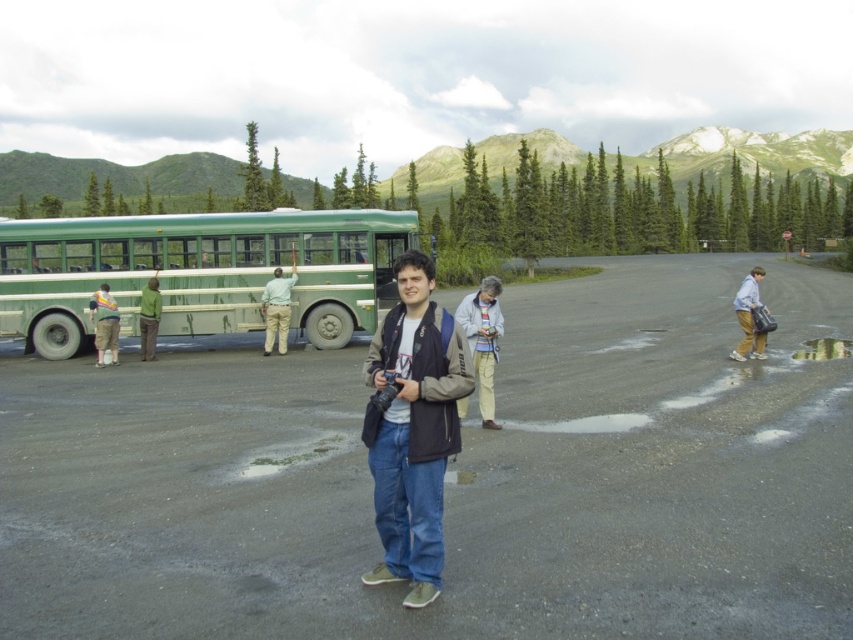
You are a photographer trying to capture a clear shot of the khaki pants at left and the green fabric pants at left in the scene. Since you want both subjects to be in focus, which one should you focus on first to ensure the other is also sharp?

You should focus on the khaki pants at left first because it is in front of the green fabric pants at left, so if you focus on the closer subject, the depth of field may include the background subject as well.

You are a delivery driver who needs to park your vehicle on the dark asphalt parking lot at center. However, you notice the transparent wet pavement at lower right nearby. Based on the scene, which parking spot would be safer to choose?

The dark asphalt parking lot at center is safer to choose because it is in front of the transparent wet pavement at lower right, indicating it is drier and more stable for parking.

You are a delivery driver who needs to park your truck in the parking lot. The truck requires a space wider than the transparent wet pavement at lower right. Can the dark asphalt parking lot at center accommodate your truck?

The dark asphalt parking lot at center is wider than the transparent wet pavement at lower right, so yes, the dark asphalt parking lot at center can accommodate the truck as it has sufficient width.